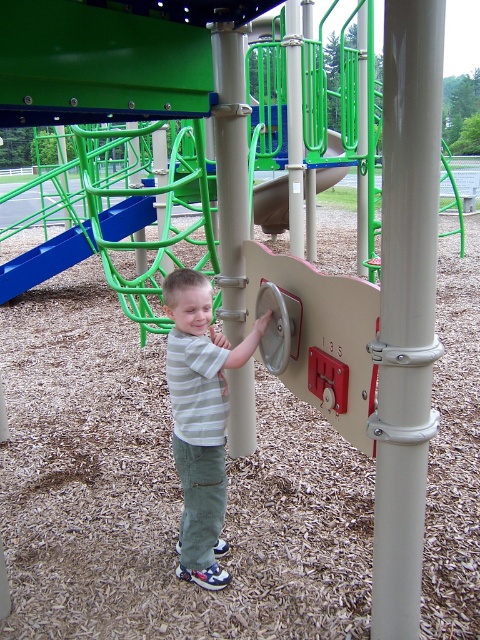
Question: Which object appears closest to the camera in this image?

Choices:
 (A) striped cotton shirt at center
 (B) white glossy pole at center

Answer: (B)

Question: Is white glossy pole at center smaller than green plastic slide at upper center?

Choices:
 (A) yes
 (B) no

Answer: (A)

Question: Estimate the real-world distances between objects in this image. Which object is farther from the smooth beige pole at center?

Choices:
 (A) white glossy pole at center
 (B) green plastic slide at upper center
 (C) striped cotton shirt at center

Answer: (B)

Question: Can you confirm if smooth beige pole at center is bigger than green plastic slide at upper center?

Choices:
 (A) yes
 (B) no

Answer: (B)

Question: From the image, what is the correct spatial relationship of striped cotton shirt at center in relation to smooth beige pole at center?

Choices:
 (A) left
 (B) right

Answer: (A)

Question: Which point appears closest to the camera in this image?

Choices:
 (A) (230, 168)
 (B) (396, 182)

Answer: (B)